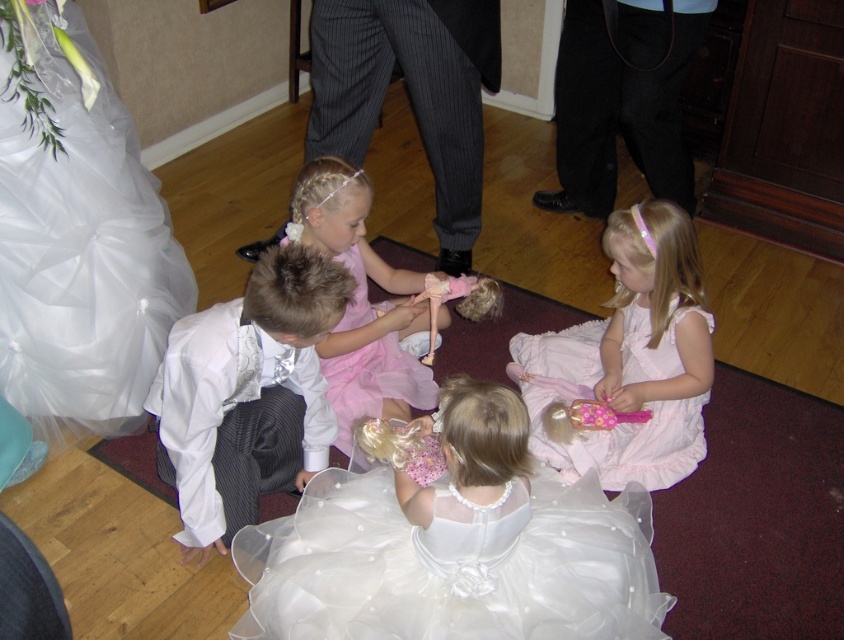
Between white tulle dress at lower left and pink tulle dress at center, which one appears on the right side from the viewer's perspective?

pink tulle dress at center

Can you confirm if white tulle dress at lower left is shorter than pink tulle dress at center?

Incorrect, white tulle dress at lower left's height does not fall short of pink tulle dress at center's.

The height and width of the screenshot is (640, 844). In order to click on white tulle dress at lower left in this screenshot , I will do `click(77, 234)`.

Where is `white tulle dress at lower left`? The width and height of the screenshot is (844, 640). white tulle dress at lower left is located at coordinates (77, 234).

Is white satin dress at center in front of pink tulle dress at lower center?

Yes.

This screenshot has height=640, width=844. What do you see at coordinates (452, 564) in the screenshot? I see `white satin dress at center` at bounding box center [452, 564].

This screenshot has height=640, width=844. I want to click on white satin dress at center, so click(452, 564).

Is white satin dress at center above pink tulle dress at center?

No.

Does point (355, 493) lie in front of point (419, 404)?

Yes, point (355, 493) is in front of point (419, 404).

Locate an element on the screen. This screenshot has width=844, height=640. white satin dress at center is located at coordinates point(452,564).